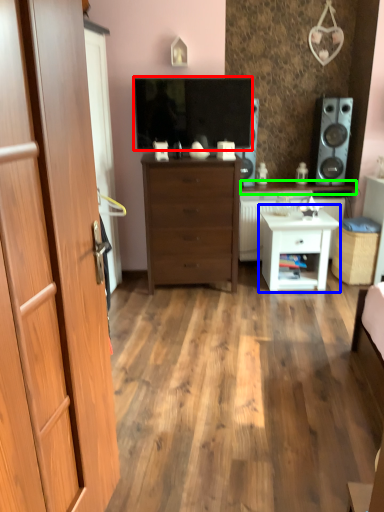
Question: Which is farther away from television (highlighted by a red box)? nightstand (highlighted by a blue box) or counter top (highlighted by a green box)?

Choices:
 (A) nightstand
 (B) counter top

Answer: (B)